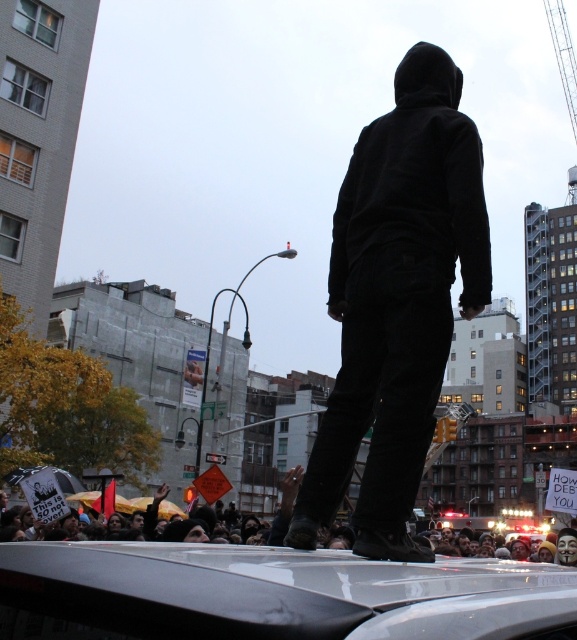
Question: Which point appears closest to the camera in this image?

Choices:
 (A) (454, 148)
 (B) (102, 624)
 (C) (433, 144)

Answer: (B)

Question: Which object is closer to the camera taking this photo?

Choices:
 (A) black matte hoodie at center
 (B) black velvety hoodie at upper center
 (C) silver metallic car at center

Answer: (C)

Question: Does black matte hoodie at center lie behind black velvety hoodie at upper center?

Choices:
 (A) yes
 (B) no

Answer: (B)

Question: Estimate the real-world distances between objects in this image. Which object is farther from the silver metallic car at center?

Choices:
 (A) black matte hoodie at center
 (B) black velvety hoodie at upper center

Answer: (B)

Question: Can you confirm if silver metallic car at center is smaller than black velvety hoodie at upper center?

Choices:
 (A) yes
 (B) no

Answer: (A)

Question: Does silver metallic car at center appear on the right side of black velvety hoodie at upper center?

Choices:
 (A) yes
 (B) no

Answer: (B)